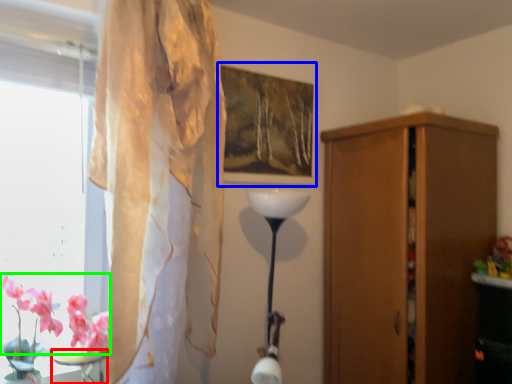
Question: Which is farther away from table (highlighted by a red box)? picture frame (highlighted by a blue box) or flower (highlighted by a green box)?

Choices:
 (A) picture frame
 (B) flower

Answer: (A)